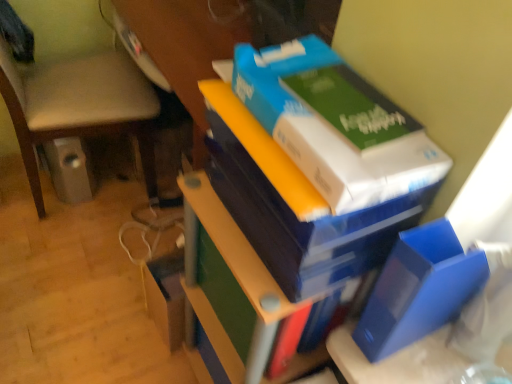
Question: Can you confirm if white cardboard box at upper right is thinner than blue matte folder at lower right, the 2th paperback book viewed from the top?

Choices:
 (A) yes
 (B) no

Answer: (B)

Question: Does white cardboard box at upper right come behind blue matte folder at lower right, the 2th paperback book viewed from the top?

Choices:
 (A) no
 (B) yes

Answer: (A)

Question: Does white cardboard box at upper right have a greater height compared to blue matte folder at lower right, the 2th paperback book viewed from the top?

Choices:
 (A) yes
 (B) no

Answer: (B)

Question: Considering the relative sizes of white cardboard box at upper right and blue matte folder at lower right, which appears as the first paperback book when ordered from the bottom, in the image provided, is white cardboard box at upper right bigger than blue matte folder at lower right, which appears as the first paperback book when ordered from the bottom,?

Choices:
 (A) no
 (B) yes

Answer: (A)

Question: Could blue matte folder at lower right, which appears as the first paperback book when ordered from the bottom, be considered to be inside white cardboard box at upper right?

Choices:
 (A) yes
 (B) no

Answer: (B)

Question: Is white cardboard box at upper right aimed at blue matte folder at lower right, which appears as the first paperback book when ordered from the bottom?

Choices:
 (A) yes
 (B) no

Answer: (B)

Question: Is the position of green matte paperback book at upper right, placed as the 2th paperback book when sorted from bottom to top, more distant than that of blue matte folder at lower right, the 2th paperback book viewed from the top?

Choices:
 (A) no
 (B) yes

Answer: (A)

Question: Is green matte paperback book at upper right, placed as the 2th paperback book when sorted from bottom to top, to the right of blue matte folder at lower right, which appears as the first paperback book when ordered from the bottom, from the viewer's perspective?

Choices:
 (A) no
 (B) yes

Answer: (A)

Question: Is green matte paperback book at upper right, which is counted as the first paperback book, starting from the top, bigger than blue matte folder at lower right, which appears as the first paperback book when ordered from the bottom?

Choices:
 (A) yes
 (B) no

Answer: (B)

Question: Is green matte paperback book at upper right, which is counted as the first paperback book, starting from the top, facing towards blue matte folder at lower right, the 2th paperback book viewed from the top?

Choices:
 (A) no
 (B) yes

Answer: (A)

Question: Considering the relative sizes of green matte paperback book at upper right, which is counted as the first paperback book, starting from the top, and blue matte folder at lower right, which appears as the first paperback book when ordered from the bottom, in the image provided, is green matte paperback book at upper right, which is counted as the first paperback book, starting from the top, shorter than blue matte folder at lower right, which appears as the first paperback book when ordered from the bottom,?

Choices:
 (A) yes
 (B) no

Answer: (A)

Question: Can you confirm if green matte paperback book at upper right, which is counted as the first paperback book, starting from the top, is taller than blue matte folder at lower right, the 2th paperback book viewed from the top?

Choices:
 (A) no
 (B) yes

Answer: (A)

Question: From the image's perspective, does blue matte folder at lower right, which appears as the first paperback book when ordered from the bottom, appear lower than beige fabric chair at lower left?

Choices:
 (A) yes
 (B) no

Answer: (A)